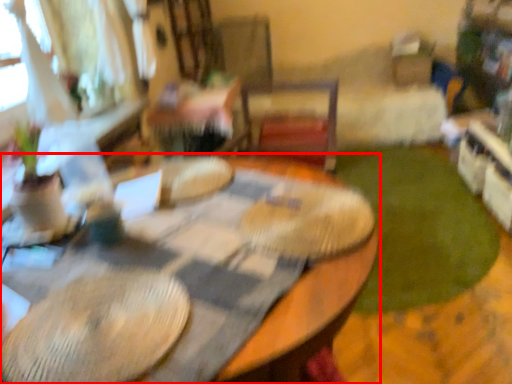
Question: Observing the image, what is the correct spatial positioning of table (annotated by the red box) in reference to grass?

Choices:
 (A) left
 (B) right

Answer: (A)